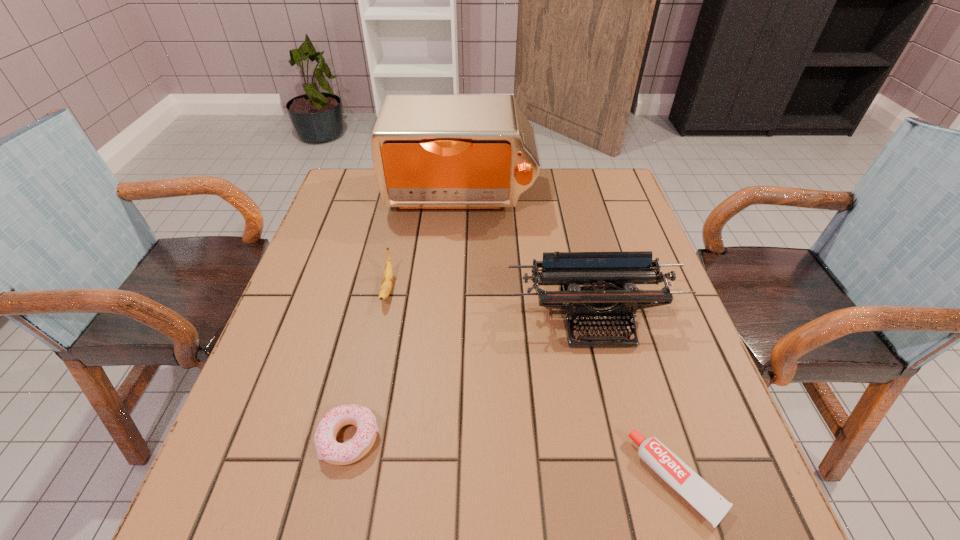
Find the location of `the tallest object`. the tallest object is located at coordinates pyautogui.click(x=478, y=152).

Locate an element on the screen. This screenshot has width=960, height=540. the farthest object is located at coordinates (478, 152).

You are a GUI agent. You are given a task and a screenshot of the screen. Output one action in this format:
    pyautogui.click(x=<x>, y=<y>)
    Task: Click on the typewriter
    This screenshot has height=540, width=960.
    Given the screenshot: What is the action you would take?
    pyautogui.click(x=608, y=278)

At what (x,y) coordinates should I click in order to perform the action: click on banana. Please return your answer as a coordinate pair (x, y). This screenshot has width=960, height=540. Looking at the image, I should click on (387, 281).

At what (x,y) coordinates should I click in order to perform the action: click on the fourth tallest object. Please return your answer as a coordinate pair (x, y). The width and height of the screenshot is (960, 540). Looking at the image, I should click on [x=328, y=449].

Image resolution: width=960 pixels, height=540 pixels. Find the location of `the shortest object`. the shortest object is located at coordinates (705, 499).

This screenshot has width=960, height=540. Find the location of `free space located on the door side of the toaster oven`. free space located on the door side of the toaster oven is located at coordinates (454, 292).

This screenshot has width=960, height=540. What are the coordinates of `free space located 0.310m on the typing side of the second tallest object` in the screenshot? It's located at (641, 509).

The height and width of the screenshot is (540, 960). I want to click on vacant space positioned on the peel of the banana from the top, so click(352, 458).

Where is `vacant space located 0.130m on the left of the fourth tallest object`? Image resolution: width=960 pixels, height=540 pixels. vacant space located 0.130m on the left of the fourth tallest object is located at coordinates (246, 439).